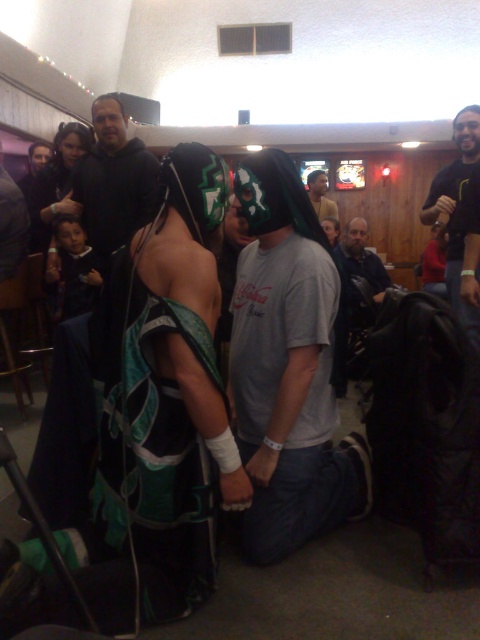
Question: Does dark gray hoodie at upper left appear under gray cotton shirt at center?

Choices:
 (A) no
 (B) yes

Answer: (B)

Question: Can you confirm if gray cotton t-shirt at center is positioned below gray cotton shirt at center?

Choices:
 (A) yes
 (B) no

Answer: (A)

Question: Which object is positioned closest to the gray cotton shirt at center?

Choices:
 (A) dark gray hoodie at upper left
 (B) gray cotton t-shirt at center
 (C) black matte shirt at right

Answer: (B)

Question: Which of these objects is positioned farthest from the dark gray hoodie at upper left?

Choices:
 (A) black matte shirt at right
 (B) gray cotton t-shirt at center
 (C) gray cotton shirt at center

Answer: (C)

Question: Which object appears closest to the camera in this image?

Choices:
 (A) black matte shirt at right
 (B) dark gray hoodie at upper left

Answer: (A)

Question: Can you confirm if dark gray hoodie at upper left is thinner than gray cotton t-shirt at center?

Choices:
 (A) no
 (B) yes

Answer: (A)